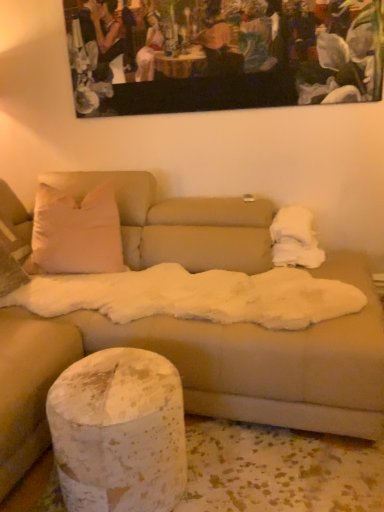
The image size is (384, 512). I want to click on white fluffy blanket at upper right, so click(x=295, y=239).

Find the location of a particular element. The height and width of the screenshot is (512, 384). speckled white cylinder at lower left is located at coordinates (119, 432).

Do you think white fluffy blanket at upper right is within speckled white cylinder at lower left, or outside of it?

white fluffy blanket at upper right is not inside speckled white cylinder at lower left, it's outside.

Who is bigger, white fluffy blanket at upper right or speckled white cylinder at lower left?

speckled white cylinder at lower left.

In the scene shown: From the image's perspective, is white fluffy blanket at upper right under speckled white cylinder at lower left?

No, from the image's perspective, white fluffy blanket at upper right is not beneath speckled white cylinder at lower left.

The image size is (384, 512). What are the coordinates of `pillar on the left of white fluffy blanket at upper right` in the screenshot? It's located at (119, 432).

Is speckled white cylinder at lower left to the left or to the right of white fluffy blanket at upper right in the image?

Clearly, speckled white cylinder at lower left is on the left of white fluffy blanket at upper right in the image.

Does speckled white cylinder at lower left have a greater width compared to white fluffy blanket at upper right?

No, speckled white cylinder at lower left is not wider than white fluffy blanket at upper right.

What's the angular difference between speckled white cylinder at lower left and white fluffy blanket at upper right's facing directions?

The angle between the facing direction of speckled white cylinder at lower left and the facing direction of white fluffy blanket at upper right is 0.556 degrees.

This screenshot has height=512, width=384. I want to click on blanket below the wooden painting at upper center (from a real-world perspective), so click(x=295, y=239).

Is white fluffy blanket at upper right positioned with its back to wooden painting at upper center?

No, white fluffy blanket at upper right's orientation is not away from wooden painting at upper center.

From a real-world perspective, which object stands above the other?

From a 3D spatial view, wooden painting at upper center is above.

Considering the sizes of white fluffy blanket at upper right and wooden painting at upper center in the image, is white fluffy blanket at upper right wider or thinner than wooden painting at upper center?

In the image, white fluffy blanket at upper right appears to be wider than wooden painting at upper center.

How many degrees apart are the facing directions of wooden painting at upper center and white fluffy blanket at upper right?

1.38 degrees separate the facing orientations of wooden painting at upper center and white fluffy blanket at upper right.

Can white fluffy blanket at upper right be found inside wooden painting at upper center?

No, white fluffy blanket at upper right is not surrounded by wooden painting at upper center.

Considering the relative sizes of wooden painting at upper center and white fluffy blanket at upper right in the image provided, is wooden painting at upper center thinner than white fluffy blanket at upper right?

Yes.

Based on the photo, from a real-world perspective, which object rests below the other?

white fluffy blanket at upper right, from a real-world perspective.

Can you confirm if wooden painting at upper center is bigger than speckled white cylinder at lower left?

Actually, wooden painting at upper center might be smaller than speckled white cylinder at lower left.

Is speckled white cylinder at lower left at the back of wooden painting at upper center?

That's not correct — wooden painting at upper center is not looking away from speckled white cylinder at lower left.

In the image, is wooden painting at upper center on the left side or the right side of speckled white cylinder at lower left?

wooden painting at upper center is to the right of speckled white cylinder at lower left.

Does speckled white cylinder at lower left touch wooden painting at upper center?

They are not placed beside each other.

From a real-world perspective, which is physically above, speckled white cylinder at lower left or wooden painting at upper center?

In real-world perspective, wooden painting at upper center is above.

Is speckled white cylinder at lower left facing towards wooden painting at upper center?

No, speckled white cylinder at lower left is not oriented towards wooden painting at upper center.

Is point (68, 474) closer or farther from the camera than point (153, 19)?

Point (68, 474) is closer to the camera than point (153, 19).

Find the location of a particular element. This screenshot has width=384, height=512. blanket positioned vertically above the speckled white cylinder at lower left (from a real-world perspective) is located at coordinates (295, 239).

Locate an element on the screen. pillar directly beneath the white fluffy blanket at upper right (from a real-world perspective) is located at coordinates (119, 432).

Considering their positions, is white fluffy blanket at upper right positioned closer to wooden painting at upper center than speckled white cylinder at lower left?

white fluffy blanket at upper right.

Considering their positions, is speckled white cylinder at lower left positioned further to wooden painting at upper center than white fluffy blanket at upper right?

speckled white cylinder at lower left is further to wooden painting at upper center.

Which object lies further to the anchor point speckled white cylinder at lower left, wooden painting at upper center or white fluffy blanket at upper right?

Among the two, wooden painting at upper center is located further to speckled white cylinder at lower left.

Looking at the image, which one is located closer to white fluffy blanket at upper right, speckled white cylinder at lower left or wooden painting at upper center?

Among the two, wooden painting at upper center is located nearer to white fluffy blanket at upper right.

Estimate the real-world distances between objects in this image. Which object is further from speckled white cylinder at lower left, white fluffy blanket at upper right or wooden painting at upper center?

wooden painting at upper center is further to speckled white cylinder at lower left.

Estimate the real-world distances between objects in this image. Which object is further from white fluffy blanket at upper right, wooden painting at upper center or speckled white cylinder at lower left?

speckled white cylinder at lower left is further to white fluffy blanket at upper right.

What are the coordinates of `blanket between wooden painting at upper center and speckled white cylinder at lower left in the up-down direction` in the screenshot? It's located at (295, 239).